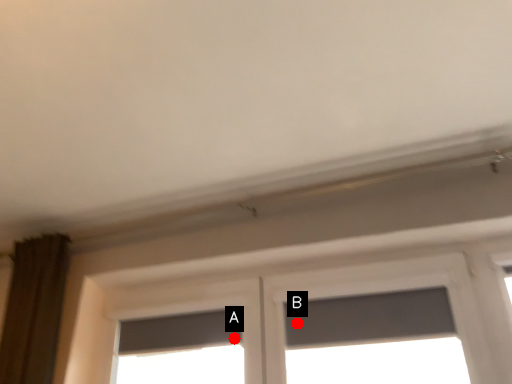
Question: Two points are circled on the image, labeled by A and B beside each circle. Which point is closer to the camera?

Choices:
 (A) A is closer
 (B) B is closer

Answer: (B)